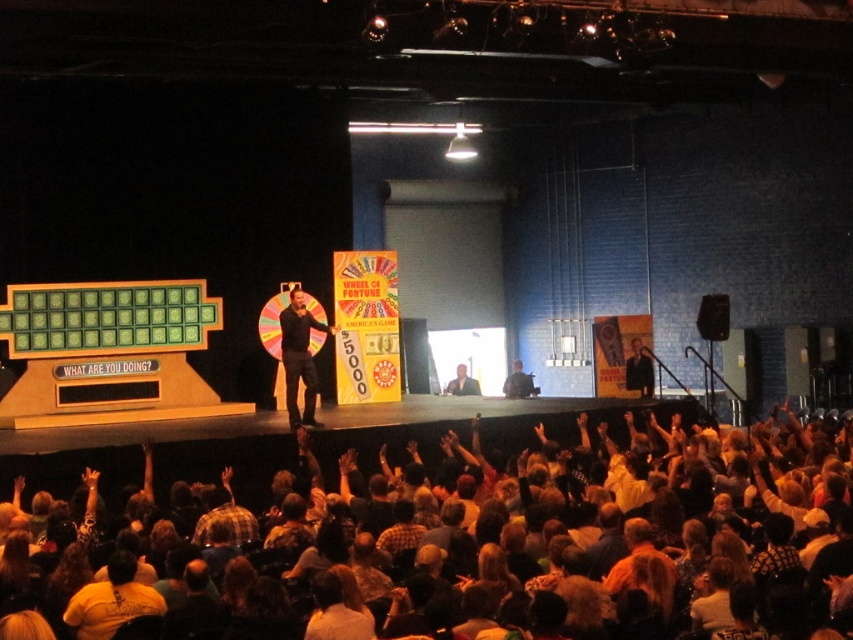
Question: Is matte black suit at center wider than plaid fabric shirt at lower center?

Choices:
 (A) yes
 (B) no

Answer: (B)

Question: Which point appears closest to the camera in this image?

Choices:
 (A) (285, 330)
 (B) (815, 598)
 (C) (630, 365)
 (D) (514, 362)

Answer: (B)

Question: Among these objects, which one is nearest to the camera?

Choices:
 (A) dark brown leather hand at upper center
 (B) matte black suit at center

Answer: (A)

Question: Can you confirm if dark suit at center is positioned to the left of dark brown leather hand at upper center?

Choices:
 (A) yes
 (B) no

Answer: (B)

Question: Does dark suit at center appear on the right side of camouflage fabric shirt at center?

Choices:
 (A) no
 (B) yes

Answer: (B)

Question: Which point is farther from the camera taking this photo?

Choices:
 (A) (646, 384)
 (B) (527, 394)
 (C) (653, 584)
 (D) (227, 484)

Answer: (B)